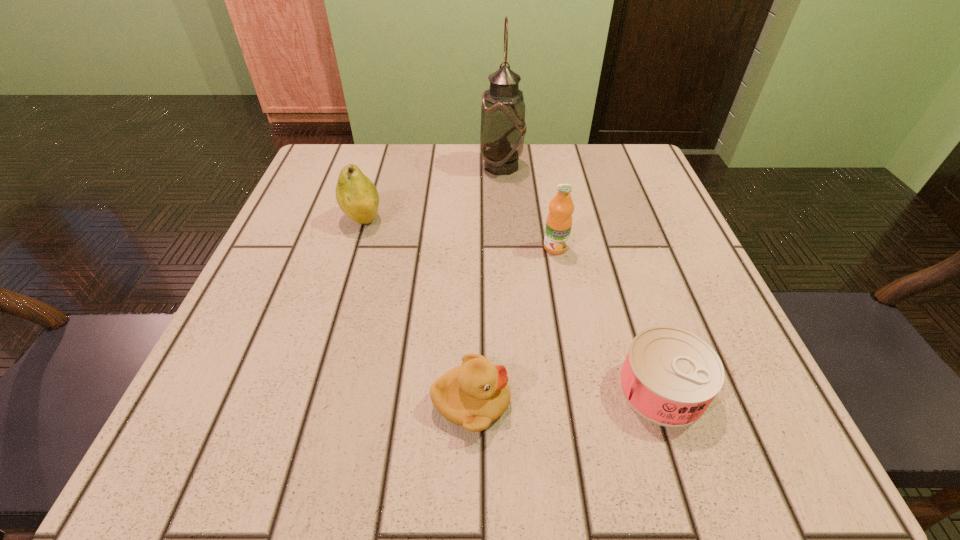
Locate an element on the screen. vacant space that satisfies the following two spatial constraints: 1. on the label of the orange juice; 2. at the beak of the duckling is located at coordinates (584, 402).